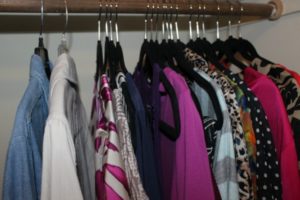
Identify the location of hangers. (35, 49), (63, 48), (97, 49), (125, 48), (112, 53), (145, 44), (185, 41), (160, 51), (205, 41), (231, 41).